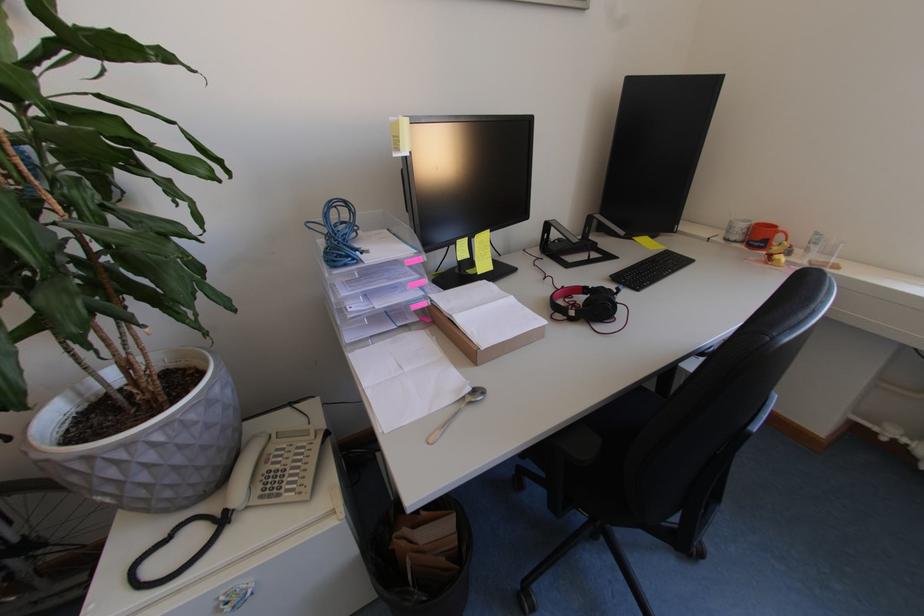
Identify the location of chair sitting surface. The width and height of the screenshot is (924, 616). (629, 411).